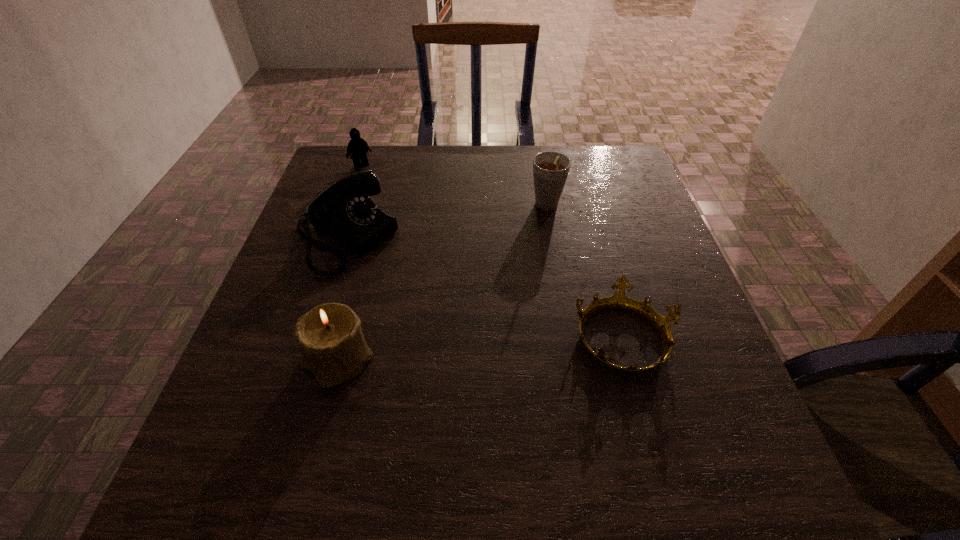
Where is `vacant spot on the desktop that is between the candle_holder and the crown and is positioned on the dial of the third shortest object`? The height and width of the screenshot is (540, 960). vacant spot on the desktop that is between the candle_holder and the crown and is positioned on the dial of the third shortest object is located at coordinates (521, 346).

Locate an element on the screen. free space on the desktop that is between the candle_holder and the crown and is positioned on the face of the farthest object is located at coordinates (505, 347).

At what (x,y) coordinates should I click in order to perform the action: click on vacant spot on the desktop that is between the candle_holder and the shortest object and is positioned on the drink side of the root beer. Please return your answer as a coordinate pair (x, y). This screenshot has width=960, height=540. Looking at the image, I should click on (495, 348).